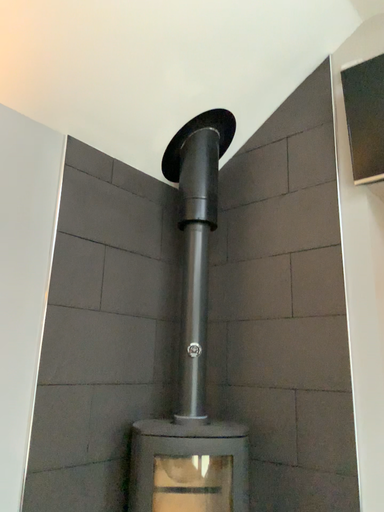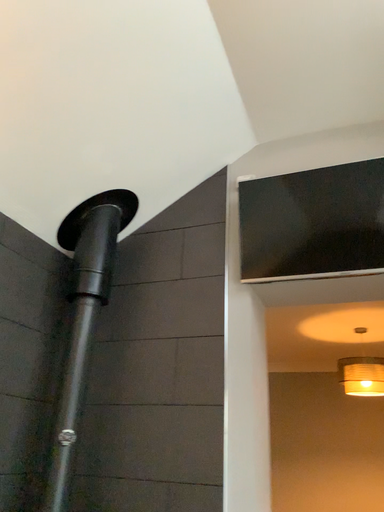
Question: Which way did the camera rotate in the video?

Choices:
 (A) rotated upward
 (B) rotated downward

Answer: (A)